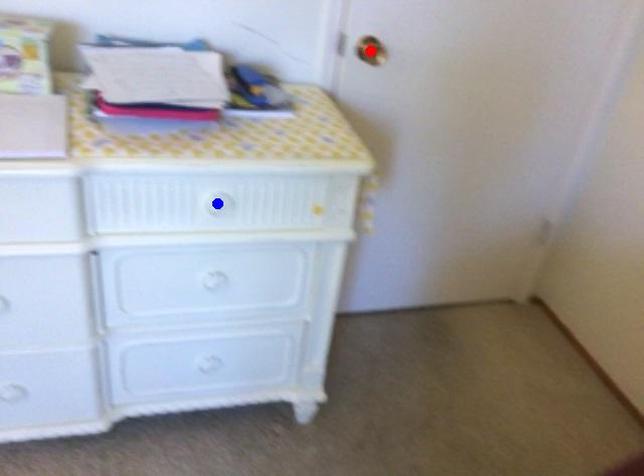
Question: Two points are marked on the image. Which point is closer to the camera?

Choices:
 (A) Blue point is closer.
 (B) Red point is closer.

Answer: (A)